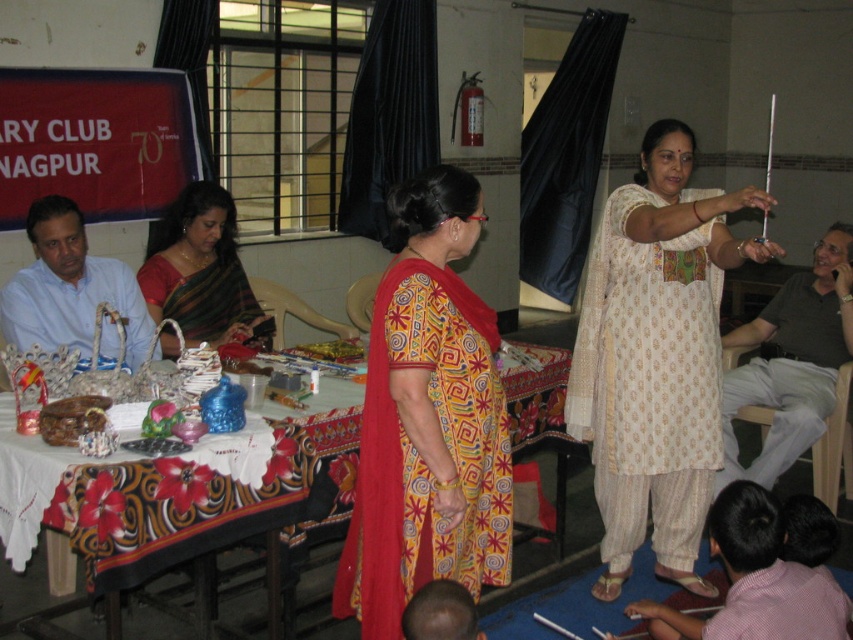
You are a fashion designer observing the event. You need to decide which garment to recommend for a client who prefers wider clothing. Which garment between the pink cotton shirt at lower right and the green silk saree at center should you suggest?

The green silk saree at center has a greater width than the pink cotton shirt at lower right, so it is the better recommendation for a client preferring wider clothing.

You are attending this event and want to place a gift on the nearest object between the patterned fabric table at center and the green silk saree at center. Which object should you choose?

The patterned fabric table at center is closer to the viewer than the green silk saree at center, so you should place the gift on the patterned fabric table at center.